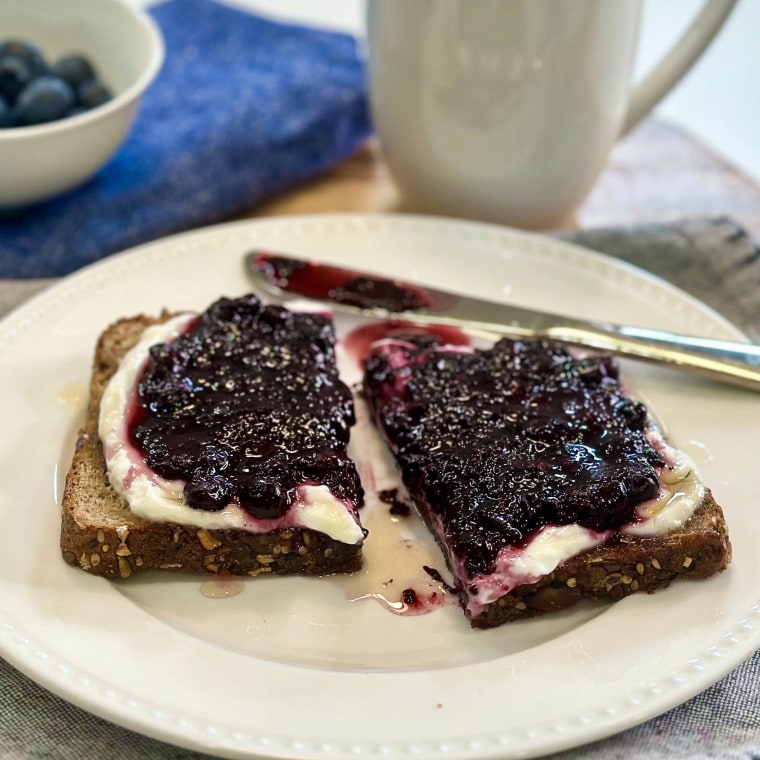
Identify the location of placemat. Image resolution: width=760 pixels, height=760 pixels. (672, 252).